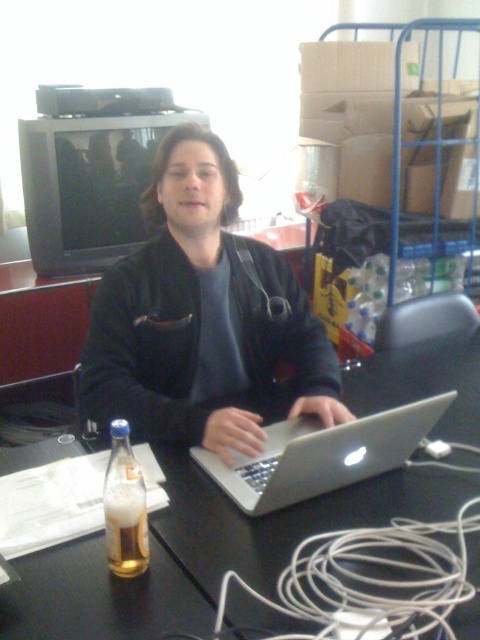
Consider the image. You are organizing the desk and need to place a new item between the translucent glass bottle at lower left and the translucent glass beer at lower left. Is this possible based on their positions?

The translucent glass bottle at lower left is to the left of the translucent glass beer at lower left, so there is no space between them for placing a new item.

You are organizing the desk and want to move the translucent glass beer at lower left to the right side. Can you move it without moving the black plastic laptop at center first?

The black plastic laptop at center is located above the translucent glass beer at lower left. Since the laptop is directly above the beer, you would need to move the laptop first to access the beer.

You are organizing a desk for an upcoming presentation. You need to place a small decorative item between the black plastic laptop at center and the translucent glass beer at lower left. Considering their heights, which object should you place the item closer to?

The black plastic laptop at center is much taller than the translucent glass beer at lower left, so you should place the item closer to the translucent glass beer at lower left to ensure stability and visibility.